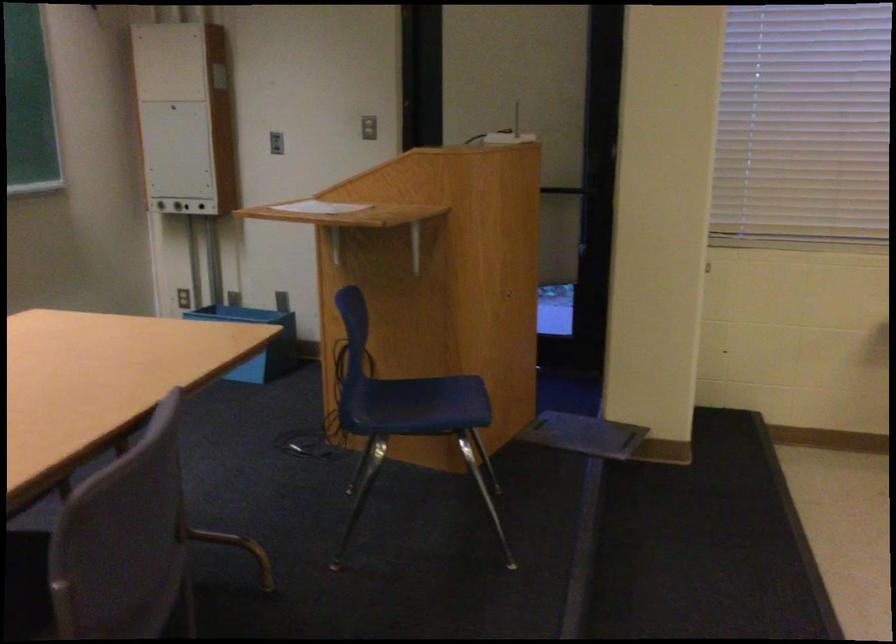
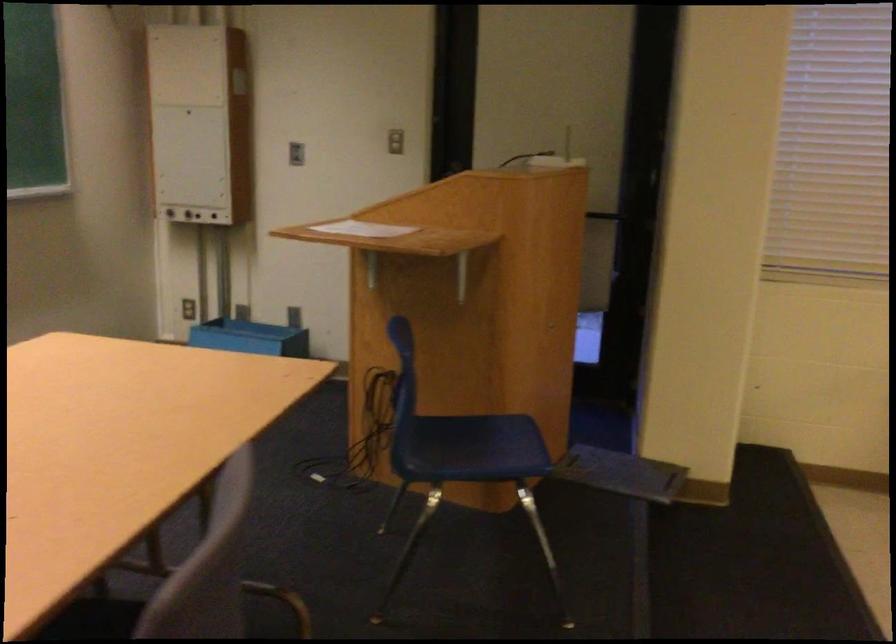
Question: I am providing you with two images of the same scene from different viewpoints. After the viewpoint changes to image2, which objects are now occluded?

Choices:
 (A) blue chair sitting surface
 (B) white router
 (C) white paper sheet
 (D) silver webcam

Answer: (B)